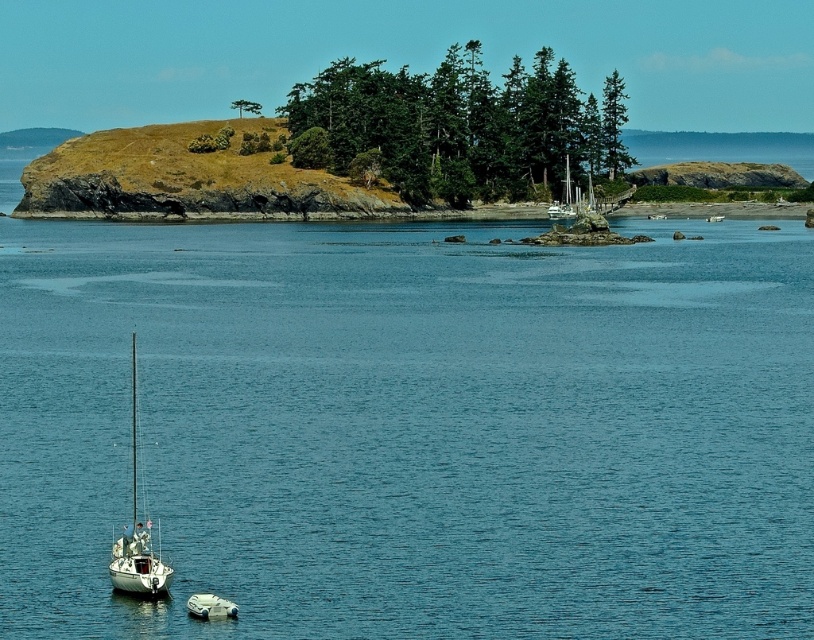
Does clear blue water at center appear on the left side of brown grassy island at center?

Incorrect, clear blue water at center is not on the left side of brown grassy island at center.

Does clear blue water at center have a larger size compared to brown grassy island at center?

Yes, clear blue water at center is bigger than brown grassy island at center.

Who is more forward, (523, 467) or (88, 193)?

Point (523, 467) is in front.

Identify the location of clear blue water at center. (409, 429).

Between point (366, 234) and point (173, 572), which one is positioned in front?

Point (173, 572) is in front.

Locate an element on the screen. clear blue water at center is located at coordinates (409, 429).

In the scene shown: Does brown grassy island at center have a greater width compared to white matte sailboat at lower left?

Correct, the width of brown grassy island at center exceeds that of white matte sailboat at lower left.

Between brown grassy island at center and white matte sailboat at lower left, which one has less height?

With less height is white matte sailboat at lower left.

Where is `brown grassy island at center`? The height and width of the screenshot is (640, 814). brown grassy island at center is located at coordinates click(x=189, y=177).

Locate an element on the screen. The width and height of the screenshot is (814, 640). brown grassy island at center is located at coordinates (189, 177).